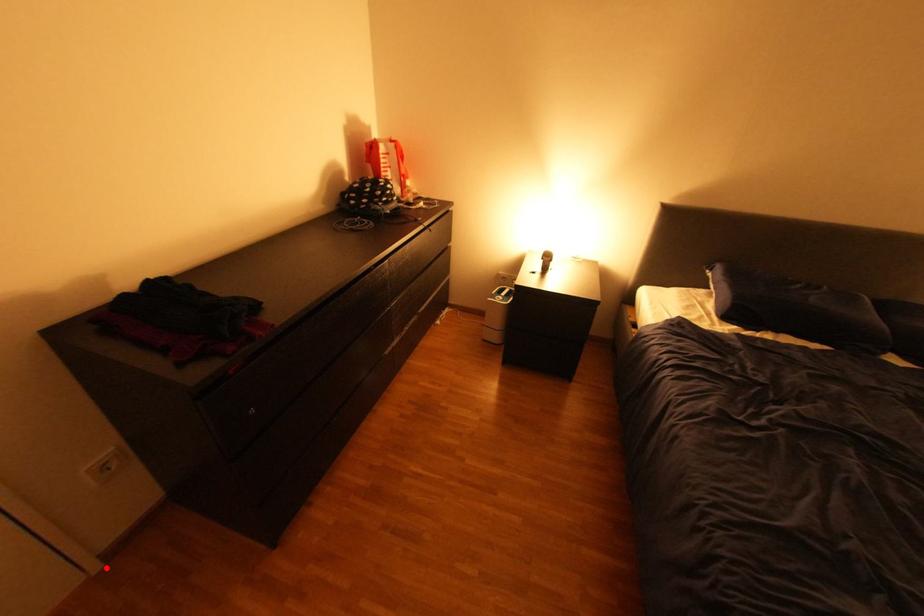
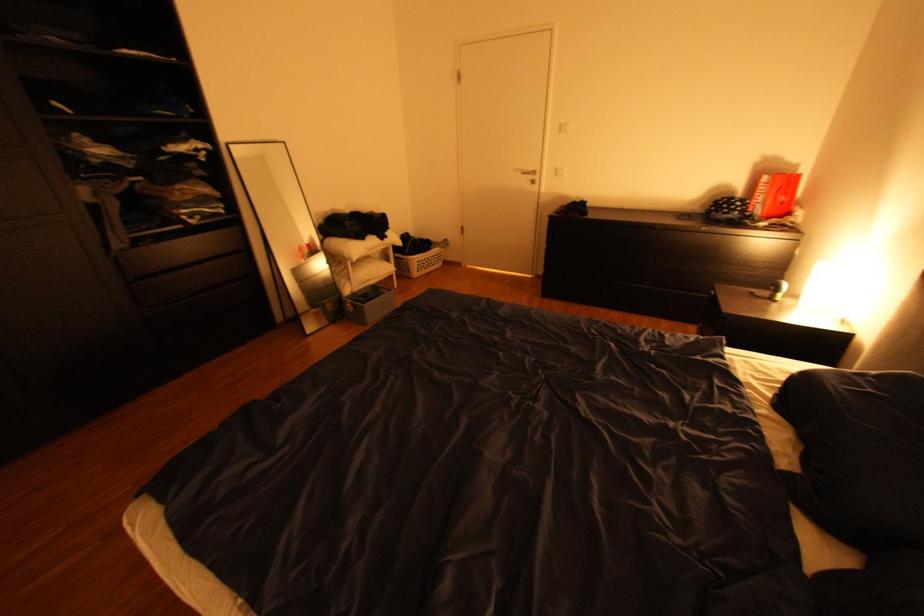
Question: I am providing you with two images of the same scene from different viewpoints. A red point is shown in image1. For the corresponding object point in image2, is it positioned nearer or farther from the camera?

Choices:
 (A) Nearer
 (B) Farther

Answer: (A)